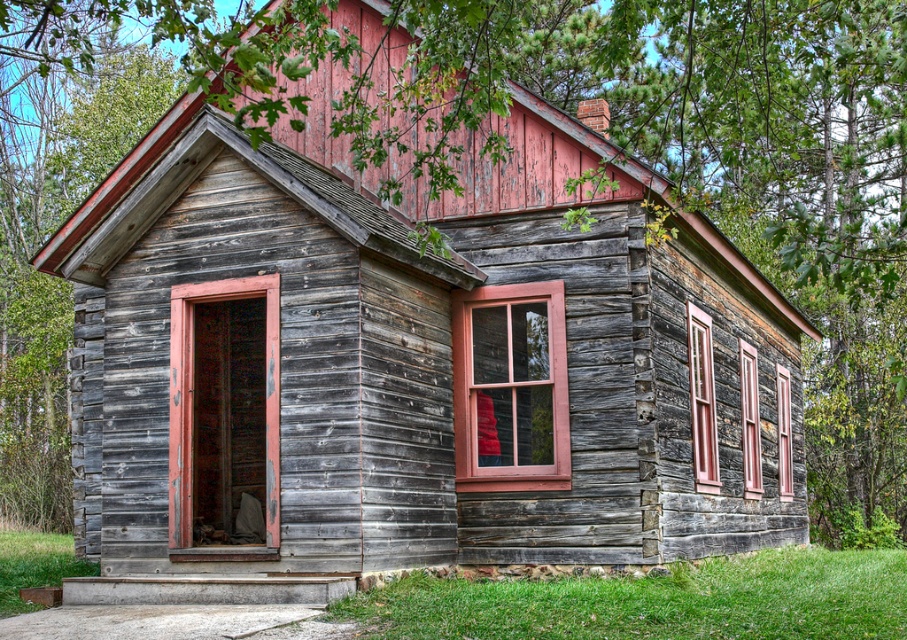
Does wooden window at right have a greater width compared to clear glass window at right?

Incorrect, wooden window at right's width does not surpass clear glass window at right's.

Between point (746, 406) and point (783, 496), which one is positioned behind?

The point (783, 496) is behind.

What do you see at coordinates (749, 420) in the screenshot? I see `wooden window at right` at bounding box center [749, 420].

At what (x,y) coordinates should I click in order to perform the action: click on wooden window at right. Please return your answer as a coordinate pair (x, y). This screenshot has height=640, width=907. Looking at the image, I should click on (749, 420).

Looking at this image, can you confirm if matte wooden window at center is positioned above wooden window at center right?

Yes, matte wooden window at center is above wooden window at center right.

Is matte wooden window at center to the right of wooden window at center right from the viewer's perspective?

No, matte wooden window at center is not to the right of wooden window at center right.

Between point (454, 305) and point (688, 337), which one is positioned in front?

Point (454, 305)

Where is `matte wooden window at center`? matte wooden window at center is located at coordinates (510, 387).

Is wooden door at center further to camera compared to clear glass window at right?

That is False.

Does wooden door at center appear on the right side of clear glass window at right?

Incorrect, wooden door at center is not on the right side of clear glass window at right.

The image size is (907, 640). Describe the element at coordinates (191, 397) in the screenshot. I see `wooden door at center` at that location.

Identify the location of wooden door at center. (191, 397).